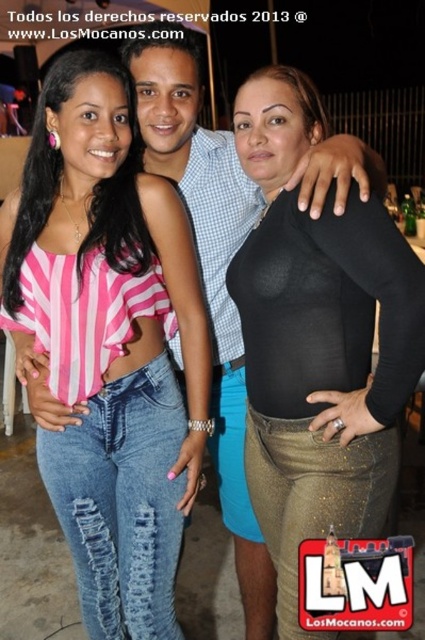
Who is more distant from viewer, (76, 513) or (334, 260)?

The point (76, 513) is behind.

Find the location of a particular element. This screenshot has width=425, height=640. pink striped fabric top at upper left is located at coordinates (108, 342).

Is point (195, 356) farther from camera compared to point (309, 321)?

Yes, it is behind point (309, 321).

Locate an element on the screen. This screenshot has height=640, width=425. pink striped fabric top at upper left is located at coordinates (108, 342).